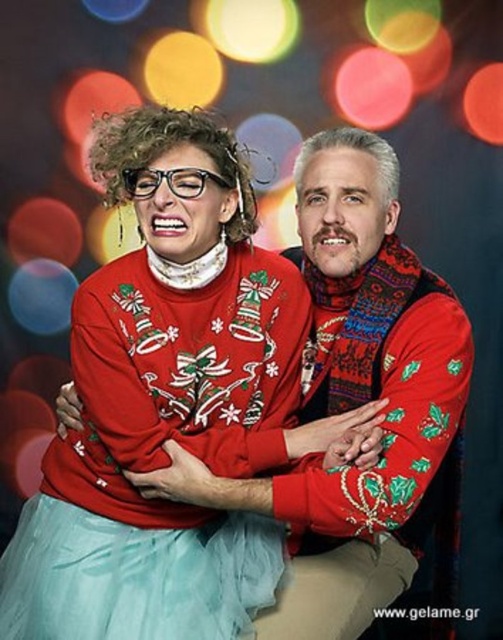
You are organizing a holiday photo shoot and need to ensure that the matte red sweater at center and the light blue tulle ballet skirt at lower left fit within a rectangular backdrop. Given that the backdrop has a width limit of 1.2 meters, can both items fit side by side horizontally without overlapping?

The matte red sweater at center might be wider than light blue tulle ballet skirt at lower left, but without exact measurements, it is uncertain if both can fit within the 1.2 meter backdrop width. Check the actual widths to confirm.

You are a photographer setting up for a holiday photo shoot. You need to ensure that both the matte red sweater at center and the light blue tulle ballet skirt at lower left are visible in the frame. Based on their positions, which object is closer to the camera?

The matte red sweater at center is closer to the camera because the light blue tulle ballet skirt at lower left is positioned behind it.

You are a fashion designer preparing for a holiday show. You need to place a 6 inch wide holiday decoration between the matte red sweater at center and the light blue tulle ballet skirt at lower left. Will there be enough space?

The distance between the matte red sweater at center and the light blue tulle ballet skirt at lower left is 5.78 inches. Since the decoration is 6 inches wide, it will not fit between them as the space is slightly smaller than the decoration.